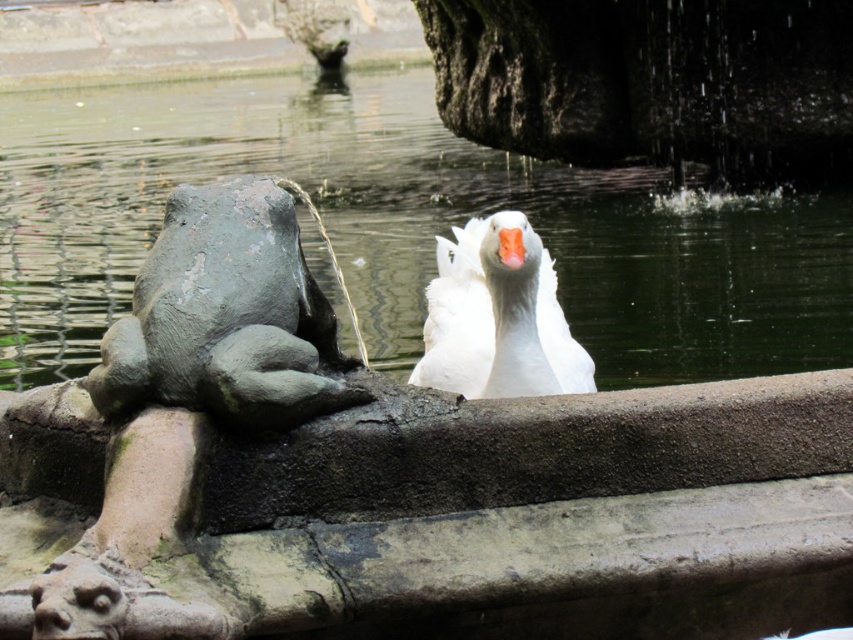
Question: Is clear water at frog left to the right of white matte duck at center from the viewer's perspective?

Choices:
 (A) yes
 (B) no

Answer: (B)

Question: Which point is farther to the camera?

Choices:
 (A) (537, 294)
 (B) (485, 152)

Answer: (B)

Question: Does clear water at frog left lie in front of white matte duck at center?

Choices:
 (A) no
 (B) yes

Answer: (B)

Question: Can you confirm if clear water at frog left is wider than white matte duck at center?

Choices:
 (A) no
 (B) yes

Answer: (B)

Question: Which point is farther to the camera?

Choices:
 (A) (534, 294)
 (B) (323, 113)

Answer: (B)

Question: Which object appears farthest from the camera in this image?

Choices:
 (A) clear water at frog left
 (B) white matte duck at center

Answer: (B)